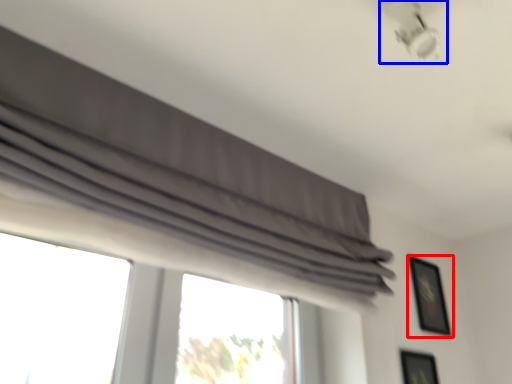
Question: Which object is closer to the camera taking this photo, picture frame (highlighted by a red box) or lamp (highlighted by a blue box)?

Choices:
 (A) picture frame
 (B) lamp

Answer: (B)